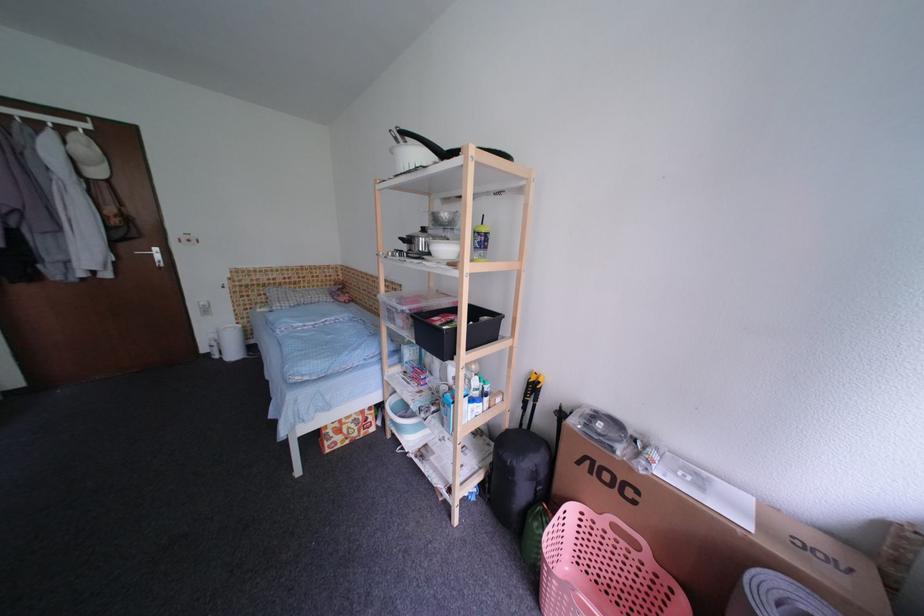
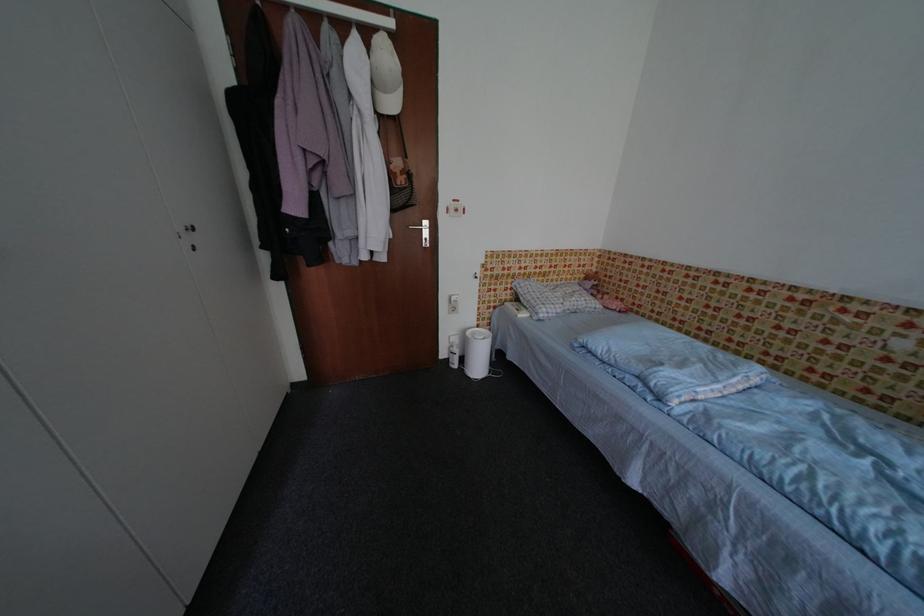
Where in the second image is the point corresponding to the point at 325,288 from the first image?

(574, 282)